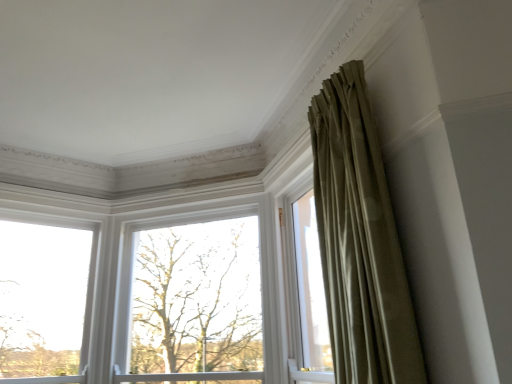
Question: Should I look upward or downward to see silky olive drab curtain at upper right?

Choices:
 (A) up
 (B) down

Answer: (B)

Question: Does white matte window at center, placed as the 1th window when sorted from right to left, appear on the right side of silky olive drab curtain at upper right?

Choices:
 (A) no
 (B) yes

Answer: (A)

Question: Does white matte window at center, which is the second window in left-to-right order, have a greater height compared to silky olive drab curtain at upper right?

Choices:
 (A) no
 (B) yes

Answer: (B)

Question: Considering the relative sizes of white matte window at center, placed as the 1th window when sorted from right to left, and silky olive drab curtain at upper right in the image provided, is white matte window at center, placed as the 1th window when sorted from right to left, bigger than silky olive drab curtain at upper right?

Choices:
 (A) yes
 (B) no

Answer: (A)

Question: Could you tell me if white matte window at center, placed as the 1th window when sorted from right to left, is facing silky olive drab curtain at upper right?

Choices:
 (A) yes
 (B) no

Answer: (B)

Question: From a real-world perspective, is white matte window at center, placed as the 1th window when sorted from right to left, below silky olive drab curtain at upper right?

Choices:
 (A) no
 (B) yes

Answer: (A)

Question: Can you confirm if white matte window at center, placed as the 1th window when sorted from right to left, is shorter than silky olive drab curtain at upper right?

Choices:
 (A) no
 (B) yes

Answer: (A)

Question: Is white matte window at center, which is the second window in left-to-right order, not near clear glass window at left, the 2th window when ordered from right to left?

Choices:
 (A) yes
 (B) no

Answer: (B)

Question: Does white matte window at center, which is the second window in left-to-right order, have a lesser height compared to clear glass window at left, the 2th window when ordered from right to left?

Choices:
 (A) no
 (B) yes

Answer: (A)

Question: Could you tell me if white matte window at center, placed as the 1th window when sorted from right to left, is turned towards clear glass window at left, which is the 1th window from left to right?

Choices:
 (A) yes
 (B) no

Answer: (B)

Question: Does white matte window at center, which is the second window in left-to-right order, contain clear glass window at left, which is the 1th window from left to right?

Choices:
 (A) yes
 (B) no

Answer: (B)

Question: Is white matte window at center, placed as the 1th window when sorted from right to left, directly adjacent to clear glass window at left, which is the 1th window from left to right?

Choices:
 (A) no
 (B) yes

Answer: (A)

Question: Is white matte window at center, placed as the 1th window when sorted from right to left, further to the viewer compared to clear glass window at left, the 2th window when ordered from right to left?

Choices:
 (A) yes
 (B) no

Answer: (A)

Question: Is clear glass window at left, the 2th window when ordered from right to left, completely or partially outside of bare branches at center?

Choices:
 (A) no
 (B) yes

Answer: (B)